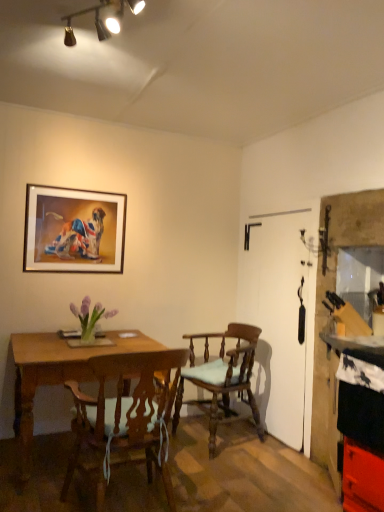
Question: In which direction should I rotate to look at wooden chair with cushion at center, positioned as the second chair in back-to-front order?

Choices:
 (A) left
 (B) right

Answer: (A)

Question: Can you confirm if wooden framed picture at upper left is positioned to the left of smooth black countertop at right?

Choices:
 (A) no
 (B) yes

Answer: (B)

Question: Considering the relative sizes of wooden framed picture at upper left and smooth black countertop at right in the image provided, is wooden framed picture at upper left taller than smooth black countertop at right?

Choices:
 (A) no
 (B) yes

Answer: (A)

Question: Considering the relative positions of wooden framed picture at upper left and smooth black countertop at right in the image provided, is wooden framed picture at upper left behind smooth black countertop at right?

Choices:
 (A) yes
 (B) no

Answer: (A)

Question: From a real-world perspective, does wooden framed picture at upper left sit lower than smooth black countertop at right?

Choices:
 (A) no
 (B) yes

Answer: (A)

Question: Can you confirm if wooden framed picture at upper left is smaller than smooth black countertop at right?

Choices:
 (A) yes
 (B) no

Answer: (A)

Question: Is wooden framed picture at upper left thinner than smooth black countertop at right?

Choices:
 (A) yes
 (B) no

Answer: (A)

Question: From the image's perspective, is smooth black countertop at right below wooden chair with cushion at center, positioned as the second chair in back-to-front order?

Choices:
 (A) yes
 (B) no

Answer: (A)

Question: Is smooth black countertop at right positioned far away from wooden chair with cushion at center, positioned as the second chair in back-to-front order?

Choices:
 (A) yes
 (B) no

Answer: (A)

Question: From a real-world perspective, is smooth black countertop at right below wooden chair with cushion at center, which is the first chair from front to back?

Choices:
 (A) yes
 (B) no

Answer: (A)

Question: From a real-world perspective, is smooth black countertop at right positioned over wooden chair with cushion at center, which is the first chair from front to back, based on gravity?

Choices:
 (A) yes
 (B) no

Answer: (B)

Question: Is smooth black countertop at right looking in the opposite direction of wooden chair with cushion at center, which is the first chair from front to back?

Choices:
 (A) no
 (B) yes

Answer: (A)

Question: Is the depth of smooth black countertop at right greater than that of wooden chair with cushion at center, positioned as the second chair in back-to-front order?

Choices:
 (A) yes
 (B) no

Answer: (A)

Question: Is wooden chair with cushion at center, which ranks as the second chair in front-to-back order, at the back of purple glass vase at center?

Choices:
 (A) no
 (B) yes

Answer: (A)